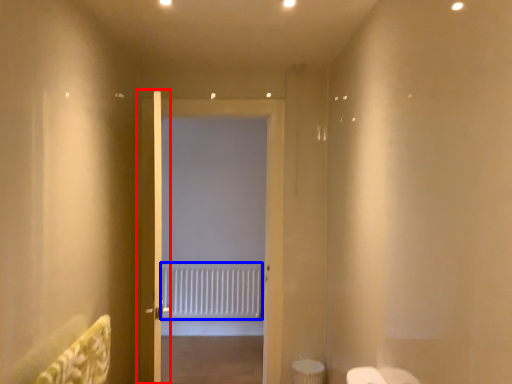
Question: Which object appears closest to the camera in this image, door (highlighted by a red box) or radiator (highlighted by a blue box)?

Choices:
 (A) door
 (B) radiator

Answer: (A)